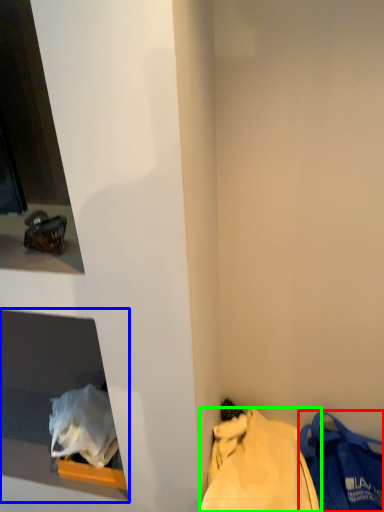
Question: Based on their relative distances, which object is farther from handbag (highlighted by a red box)? Choose from cabinet (highlighted by a blue box) and tote bag (highlighted by a green box).

Choices:
 (A) cabinet
 (B) tote bag

Answer: (A)